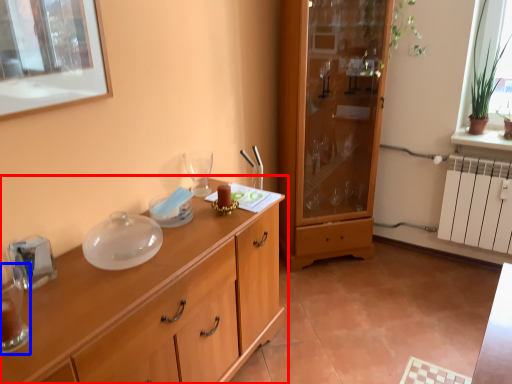
Question: Which of the following is the farthest to the observer, cupboard (highlighted by a red box) or tableware (highlighted by a blue box)?

Choices:
 (A) cupboard
 (B) tableware

Answer: (B)